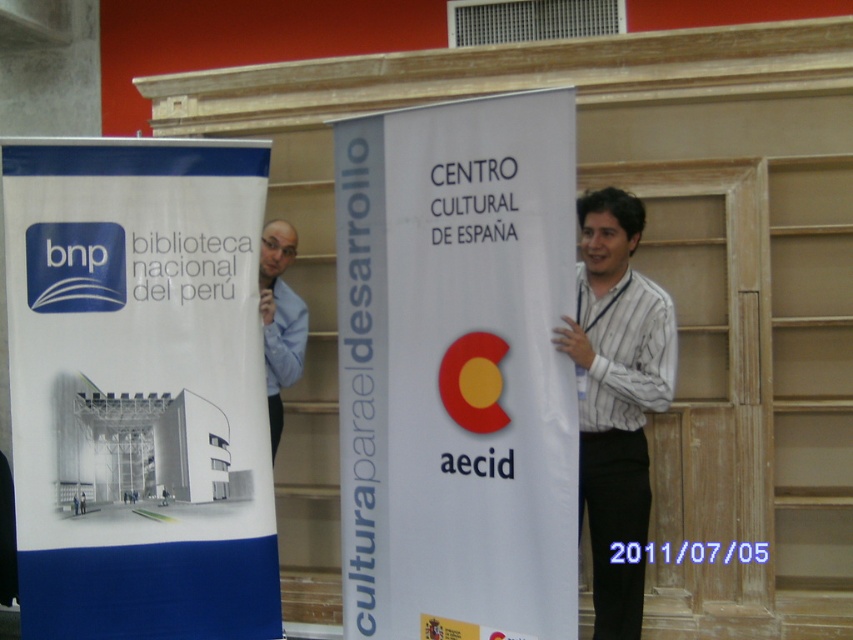
You are standing at the camera position and want to take a photo of the point at coordinates point (643, 566). Is this point within your camera view? Assume your camera has a standard 50mm lens with a 46 degree horizontal field of view and the camera is positioned to capture the entire scene.

The point at coordinates point (643, 566) is 13.54 feet away from the camera. Since the camera has a standard 50mm lens with a 46 degree horizontal field of view, and the point is within the scene captured by the camera, it is likely within the camera view. However, exact visibility depends on the camera orientation and zoom level, but based on the given distance and standard field of view, the point should be visible.

You are an attendee at the event and want to read the text on both the white paper poster at left and the white paper banner at center. Which one is closer to you?

The white paper poster at left is closer to you because the white paper banner at center is behind it.